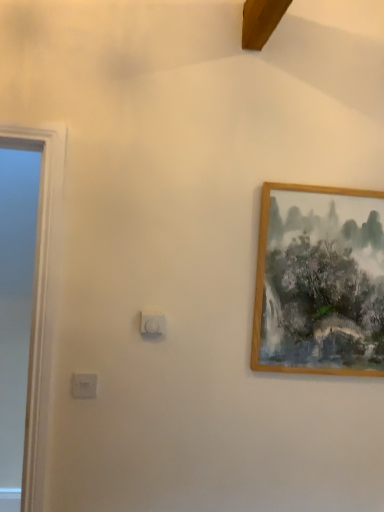
The width and height of the screenshot is (384, 512). I want to click on wooden picture frame at upper right, so click(319, 281).

The width and height of the screenshot is (384, 512). I want to click on white plastic light switch at center, which is counted as the 2th light switch, starting from the left, so click(153, 323).

From a real-world perspective, which is physically above, wooden picture frame at upper right or white plastic light switch at lower left, the 2th light switch positioned from the top?

In real-world perspective, wooden picture frame at upper right is above.

Which point is more forward, (327, 271) or (90, 397)?

The point (90, 397) is in front.

Based on the photo, is wooden picture frame at upper right in front of or behind white plastic light switch at lower left, positioned as the 1th light switch in bottom-to-top order, in the image?

In the image, wooden picture frame at upper right appears behind white plastic light switch at lower left, positioned as the 1th light switch in bottom-to-top order.

Which is less distant, (332, 301) or (154, 323)?

The point (154, 323) is closer.

Is wooden picture frame at upper right not inside white plastic light switch at center, which is counted as the 2th light switch, starting from the left?

wooden picture frame at upper right is positioned outside white plastic light switch at center, which is counted as the 2th light switch, starting from the left.

Who is smaller, wooden picture frame at upper right or white plastic light switch at center, the 1th light switch when ordered from right to left?

white plastic light switch at center, the 1th light switch when ordered from right to left.

Considering the relative sizes of wooden picture frame at upper right and white plastic light switch at center, the 2th light switch positioned from the bottom, in the image provided, is wooden picture frame at upper right shorter than white plastic light switch at center, the 2th light switch positioned from the bottom,?

Incorrect, the height of wooden picture frame at upper right does not fall short of that of white plastic light switch at center, the 2th light switch positioned from the bottom.

In terms of size, does white plastic light switch at lower left, the 2th light switch positioned from the top, appear bigger or smaller than wooden picture frame at upper right?

Clearly, white plastic light switch at lower left, the 2th light switch positioned from the top, is smaller in size than wooden picture frame at upper right.

From the image's perspective, would you say white plastic light switch at lower left, positioned as the 1th light switch in bottom-to-top order, is positioned over wooden picture frame at upper right?

No, from the image's perspective, white plastic light switch at lower left, positioned as the 1th light switch in bottom-to-top order, is not over wooden picture frame at upper right.

Identify the location of picture frame located above the white plastic light switch at lower left, positioned as the 1th light switch in bottom-to-top order (from the image's perspective). pyautogui.click(x=319, y=281).

Is white plastic light switch at lower left, the first light switch viewed from the left, to the right of wooden picture frame at upper right from the viewer's perspective?

In fact, white plastic light switch at lower left, the first light switch viewed from the left, is to the left of wooden picture frame at upper right.

Would you say white plastic light switch at center, the 2th light switch positioned from the bottom, is inside or outside wooden picture frame at upper right?

white plastic light switch at center, the 2th light switch positioned from the bottom, is located beyond the bounds of wooden picture frame at upper right.

Looking at this image, considering the relative sizes of white plastic light switch at center, the 1th light switch when ordered from right to left, and wooden picture frame at upper right in the image provided, is white plastic light switch at center, the 1th light switch when ordered from right to left, bigger than wooden picture frame at upper right?

Incorrect, white plastic light switch at center, the 1th light switch when ordered from right to left, is not larger than wooden picture frame at upper right.

Where is `picture frame above the white plastic light switch at center, the 1th light switch when ordered from right to left (from a real-world perspective)`? This screenshot has height=512, width=384. picture frame above the white plastic light switch at center, the 1th light switch when ordered from right to left (from a real-world perspective) is located at coordinates pos(319,281).

Considering the sizes of white plastic light switch at center, the 2th light switch positioned from the bottom, and wooden picture frame at upper right in the image, is white plastic light switch at center, the 2th light switch positioned from the bottom, wider or thinner than wooden picture frame at upper right?

Clearly, white plastic light switch at center, the 2th light switch positioned from the bottom, has less width compared to wooden picture frame at upper right.

Which is nearer, [88,375] or [149,331]?

Positioned in front is point [88,375].

Can you tell me how much white plastic light switch at lower left, which ranks as the 2th light switch in right-to-left order, and white plastic light switch at center, the 1th light switch in the top-to-bottom sequence, differ in facing direction?

The angle between the facing direction of white plastic light switch at lower left, which ranks as the 2th light switch in right-to-left order, and the facing direction of white plastic light switch at center, the 1th light switch in the top-to-bottom sequence, is 0.00729 degrees.

Considering the sizes of objects white plastic light switch at lower left, the first light switch viewed from the left, and white plastic light switch at center, the 2th light switch positioned from the bottom, in the image provided, who is thinner, white plastic light switch at lower left, the first light switch viewed from the left, or white plastic light switch at center, the 2th light switch positioned from the bottom,?

white plastic light switch at lower left, the first light switch viewed from the left, is thinner.

Is the surface of white plastic light switch at lower left, which ranks as the 2th light switch in right-to-left order, in direct contact with white plastic light switch at center, the 1th light switch when ordered from right to left?

No, white plastic light switch at lower left, which ranks as the 2th light switch in right-to-left order, is not beside white plastic light switch at center, the 1th light switch when ordered from right to left.

Does white plastic light switch at center, the 1th light switch in the top-to-bottom sequence, appear on the left side of white plastic light switch at lower left, the 2th light switch positioned from the top?

Incorrect, white plastic light switch at center, the 1th light switch in the top-to-bottom sequence, is not on the left side of white plastic light switch at lower left, the 2th light switch positioned from the top.

Are white plastic light switch at center, which is counted as the 2th light switch, starting from the left, and white plastic light switch at lower left, which ranks as the 2th light switch in right-to-left order, far apart?

No, white plastic light switch at center, which is counted as the 2th light switch, starting from the left, is not far away from white plastic light switch at lower left, which ranks as the 2th light switch in right-to-left order.

Which of these two, white plastic light switch at center, the 2th light switch positioned from the bottom, or white plastic light switch at lower left, positioned as the 1th light switch in bottom-to-top order, is smaller?

With smaller size is white plastic light switch at lower left, positioned as the 1th light switch in bottom-to-top order.

Which of these two, white plastic light switch at center, the 1th light switch when ordered from right to left, or white plastic light switch at lower left, which ranks as the 2th light switch in right-to-left order, is thinner?

white plastic light switch at lower left, which ranks as the 2th light switch in right-to-left order.

Where is `picture frame on the right of white plastic light switch at lower left, the first light switch viewed from the left`? Image resolution: width=384 pixels, height=512 pixels. picture frame on the right of white plastic light switch at lower left, the first light switch viewed from the left is located at coordinates (319, 281).

Identify the location of picture frame behind the white plastic light switch at center, the 1th light switch in the top-to-bottom sequence. Image resolution: width=384 pixels, height=512 pixels. (319, 281).

Considering their positions, is white plastic light switch at lower left, which ranks as the 2th light switch in right-to-left order, positioned closer to white plastic light switch at center, the 2th light switch positioned from the bottom, than wooden picture frame at upper right?

white plastic light switch at lower left, which ranks as the 2th light switch in right-to-left order, is closer to white plastic light switch at center, the 2th light switch positioned from the bottom.

Based on their spatial positions, is white plastic light switch at center, the 1th light switch when ordered from right to left, or white plastic light switch at lower left, which ranks as the 2th light switch in right-to-left order, closer to wooden picture frame at upper right?

The object closer to wooden picture frame at upper right is white plastic light switch at center, the 1th light switch when ordered from right to left.

In the scene shown: Which object lies nearer to the anchor point white plastic light switch at lower left, which ranks as the 2th light switch in right-to-left order, white plastic light switch at center, the 1th light switch when ordered from right to left, or wooden picture frame at upper right?

white plastic light switch at center, the 1th light switch when ordered from right to left, is closer to white plastic light switch at lower left, which ranks as the 2th light switch in right-to-left order.

Looking at the image, which one is located further to white plastic light switch at lower left, the first light switch viewed from the left, wooden picture frame at upper right or white plastic light switch at center, which is counted as the 2th light switch, starting from the left?

wooden picture frame at upper right is further to white plastic light switch at lower left, the first light switch viewed from the left.

Which object lies further to the anchor point wooden picture frame at upper right, white plastic light switch at lower left, the 2th light switch positioned from the top, or white plastic light switch at center, which is counted as the 2th light switch, starting from the left?

white plastic light switch at lower left, the 2th light switch positioned from the top, lies further to wooden picture frame at upper right than the other object.

When comparing their distances from white plastic light switch at center, the 1th light switch when ordered from right to left, does wooden picture frame at upper right or white plastic light switch at lower left, which ranks as the 2th light switch in right-to-left order, seem closer?

white plastic light switch at lower left, which ranks as the 2th light switch in right-to-left order.

The height and width of the screenshot is (512, 384). Find the location of `light switch between white plastic light switch at lower left, the 2th light switch positioned from the top, and wooden picture frame at upper right, in the horizontal direction`. light switch between white plastic light switch at lower left, the 2th light switch positioned from the top, and wooden picture frame at upper right, in the horizontal direction is located at coordinates (153, 323).